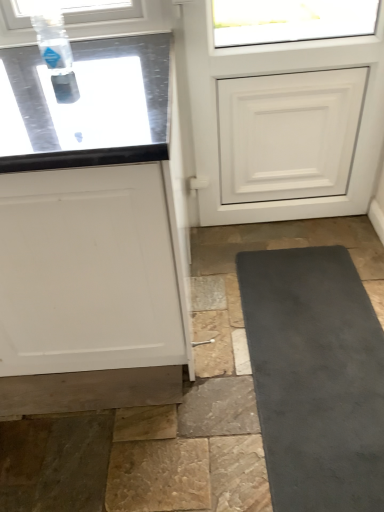
Question: Considering the relative positions of white matte cabinet at left and white matte door at upper center in the image provided, is white matte cabinet at left in front of white matte door at upper center?

Choices:
 (A) yes
 (B) no

Answer: (A)

Question: Is white matte cabinet at left thinner than white matte door at upper center?

Choices:
 (A) yes
 (B) no

Answer: (B)

Question: Is white matte cabinet at left taller than white matte door at upper center?

Choices:
 (A) no
 (B) yes

Answer: (A)

Question: From a real-world perspective, is white matte cabinet at left positioned under white matte door at upper center based on gravity?

Choices:
 (A) no
 (B) yes

Answer: (B)

Question: Does white matte cabinet at left have a smaller size compared to white matte door at upper center?

Choices:
 (A) yes
 (B) no

Answer: (B)

Question: Would you say white matte door at upper center is inside or outside transparent plastic bottle at upper left?

Choices:
 (A) inside
 (B) outside

Answer: (B)

Question: Is point (316, 20) closer or farther from the camera than point (33, 16)?

Choices:
 (A) closer
 (B) farther

Answer: (B)

Question: From a real-world perspective, relative to transparent plastic bottle at upper left, is white matte door at upper center vertically above or below?

Choices:
 (A) below
 (B) above

Answer: (A)

Question: Based on their sizes in the image, would you say white matte door at upper center is bigger or smaller than transparent plastic bottle at upper left?

Choices:
 (A) big
 (B) small

Answer: (A)

Question: Is point (137, 354) positioned closer to the camera than point (36, 37)?

Choices:
 (A) closer
 (B) farther

Answer: (A)

Question: Is white matte cabinet at left wider or thinner than transparent plastic bottle at upper left?

Choices:
 (A) thin
 (B) wide

Answer: (B)

Question: From a real-world perspective, is white matte cabinet at left positioned above or below transparent plastic bottle at upper left?

Choices:
 (A) below
 (B) above

Answer: (A)

Question: Relative to transparent plastic bottle at upper left, is white matte cabinet at left in front or behind?

Choices:
 (A) front
 (B) behind

Answer: (A)

Question: In terms of width, does white matte cabinet at left look wider or thinner when compared to white matte door at upper center?

Choices:
 (A) wide
 (B) thin

Answer: (A)

Question: From their relative heights in the image, would you say white matte cabinet at left is taller or shorter than white matte door at upper center?

Choices:
 (A) tall
 (B) short

Answer: (B)